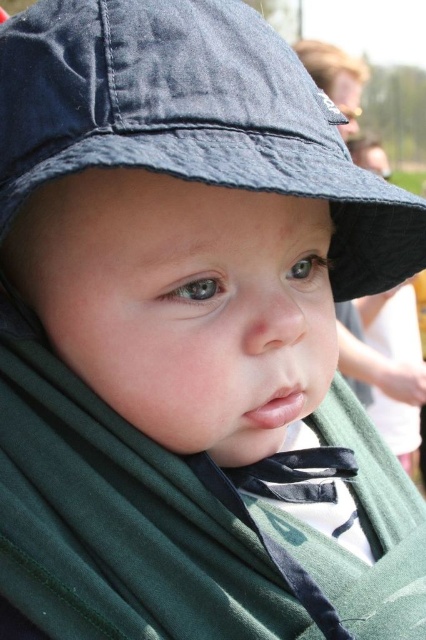
You are a photographer taking a close up shot of a baby. You have two items in focus, the green soft fabric shawl at center and the dark blue fabric hat at upper center. Which item is closer to your camera lens?

The green soft fabric shawl at center is closer to the camera lens because it is further to the viewer than the dark blue fabric hat at upper center.